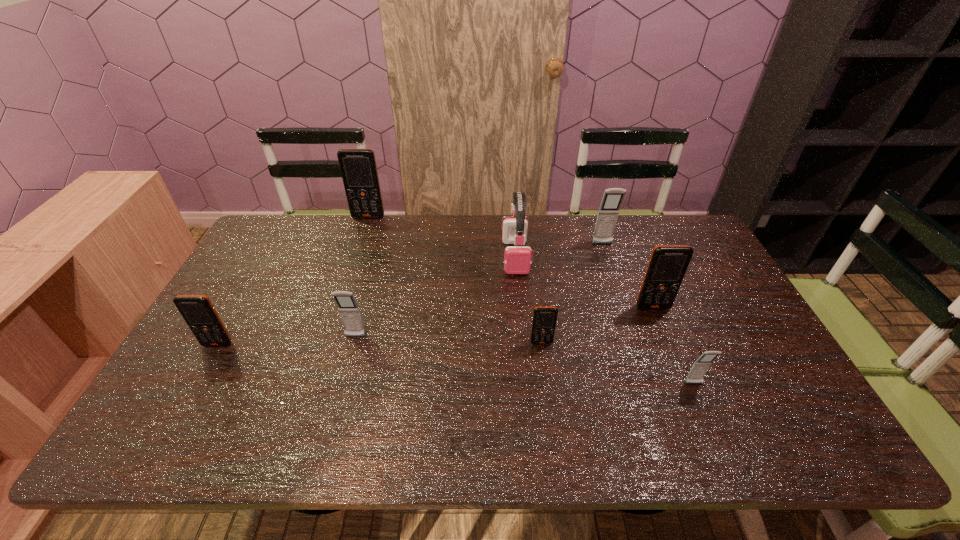
This screenshot has width=960, height=540. In order to click on the leftmost orange cellular telephone in this screenshot , I will do click(197, 310).

This screenshot has width=960, height=540. I want to click on the third orange cellular telephone from left to right, so click(544, 320).

Identify the location of the smallest orange cellular telephone. The width and height of the screenshot is (960, 540). (544, 320).

The height and width of the screenshot is (540, 960). I want to click on the rightmost gray cellular telephone, so click(700, 367).

Locate an element on the screen. Image resolution: width=960 pixels, height=540 pixels. the smallest gray cellular telephone is located at coordinates (700, 367).

Find the location of `vacant space located on the screen of the second orange cellular telephone from left to right`. vacant space located on the screen of the second orange cellular telephone from left to right is located at coordinates (348, 281).

What are the coordinates of `free space located 0.260m on the outer surface of the pink earphone` in the screenshot? It's located at (523, 340).

Locate an element on the screen. The image size is (960, 540). vacant region located on the front-facing side of the farthest gray cellular telephone is located at coordinates (617, 289).

The width and height of the screenshot is (960, 540). I want to click on vacant space located 0.300m on the screen of the fifth nearest cellular telephone, so [x=691, y=402].

At what (x,y) coordinates should I click in order to perform the action: click on vacant position located on the front-facing side of the fourth nearest cellular telephone. Please return your answer as a coordinate pair (x, y). Looking at the image, I should click on (347, 370).